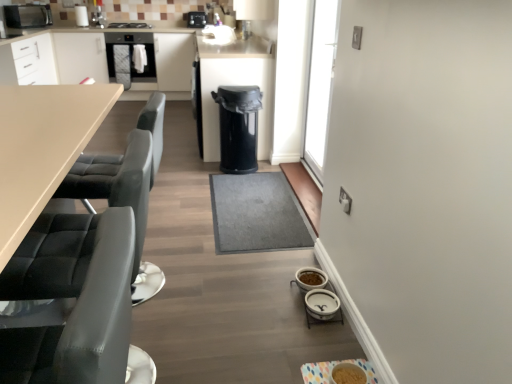
You are a GUI agent. You are given a task and a screenshot of the screen. Output one action in this format:
    pyautogui.click(x=<x>, y=<y>)
    Task: Click on the free location in front of white ceramic bowls at lower right, which appears as the 2th appliance when viewed from the front
    
    Given the screenshot: What is the action you would take?
    pyautogui.click(x=314, y=344)